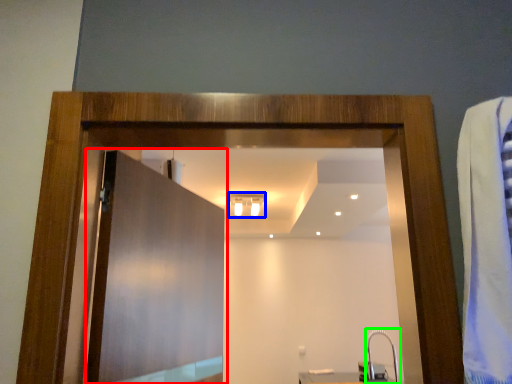
Question: Which object is the farthest from door (highlighted by a red box)? Choose among these: light fixture (highlighted by a blue box) or faucet (highlighted by a green box).

Choices:
 (A) light fixture
 (B) faucet

Answer: (B)